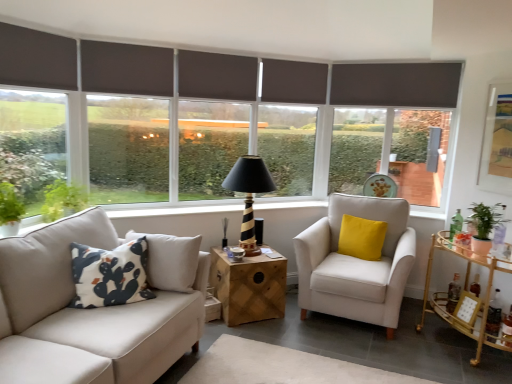
Find the location of `free space above dark gray roller blind at left, which is the 4th window from right to left (from a real-world perspective)`. free space above dark gray roller blind at left, which is the 4th window from right to left (from a real-world perspective) is located at coordinates [x=37, y=25].